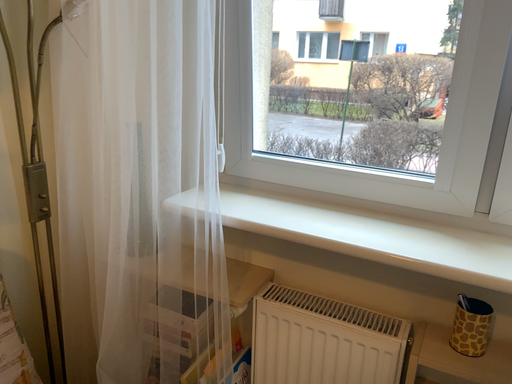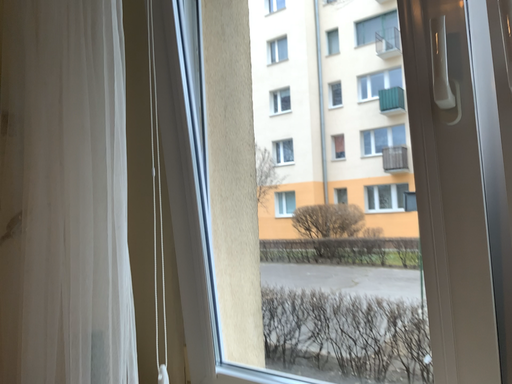
Question: How did the camera likely rotate when shooting the video?

Choices:
 (A) rotated upward
 (B) rotated downward

Answer: (A)